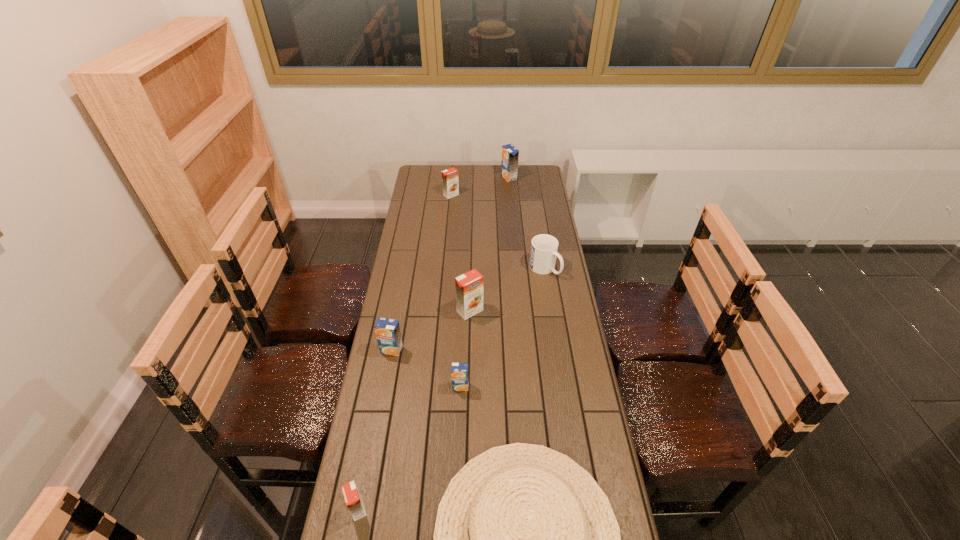
Where is `the fourth closest orange juice to the rightmost orange juice`? The height and width of the screenshot is (540, 960). the fourth closest orange juice to the rightmost orange juice is located at coordinates (459, 371).

Select which orange juice is the second closest to the mug. Please provide its 2D coordinates. Your answer should be formatted as a tuple, i.e. [(x, y)], where the tuple contains the x and y coordinates of a point satisfying the conditions above.

[(459, 371)]

Identify which blue orange_juice is the third nearest to the biggest orange orange juice. Please provide its 2D coordinates. Your answer should be formatted as a tuple, i.e. [(x, y)], where the tuple contains the x and y coordinates of a point satisfying the conditions above.

[(510, 154)]

Select which blue orange_juice is the closest to the gray sunhat. Please provide its 2D coordinates. Your answer should be formatted as a tuple, i.e. [(x, y)], where the tuple contains the x and y coordinates of a point satisfying the conditions above.

[(459, 371)]

Identify the location of the second closest orange orange juice to the blue mug. The height and width of the screenshot is (540, 960). (450, 182).

At what (x,y) coordinates should I click in order to perform the action: click on orange orange juice that stands as the closest to the second orange orange juice from left to right. Please return your answer as a coordinate pair (x, y). The height and width of the screenshot is (540, 960). Looking at the image, I should click on (469, 286).

The width and height of the screenshot is (960, 540). Identify the location of free location that satisfies the following two spatial constraints: 1. on the back side of the third farthest orange juice; 2. on the right side of the mug. (471, 268).